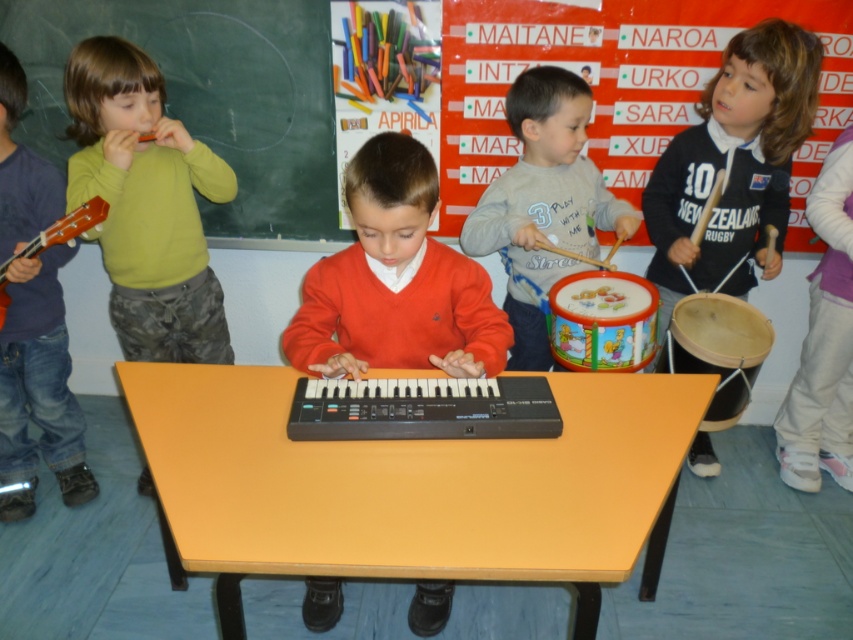
In the classroom scene, there are two children wearing blue denim jeans at left and gray cotton shirt at center. Which child is positioned to the left of the other?

The blue denim jeans at left is positioned on the left side of gray cotton shirt at center.

You are a teacher in the classroom and want to hand out a music sheet to the child in blue denim jeans at left and the child in gray cotton shirt at center. If you have a stack of music sheets on the table, which child would you need to reach higher to give the music sheet to?

The blue denim jeans at left is much taller than the gray cotton shirt at center, so you would need to reach higher to give the music sheet to the blue denim jeans at left.